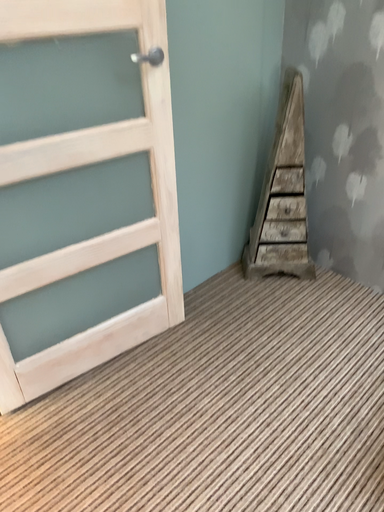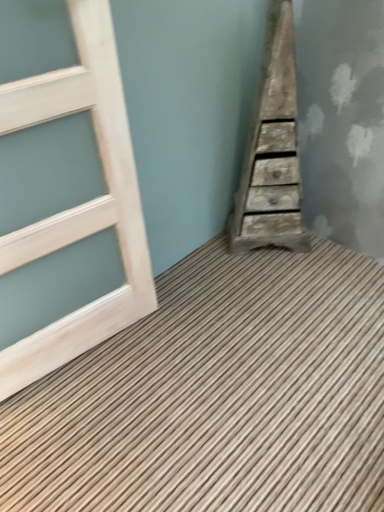
Question: Which way did the camera rotate in the video?

Choices:
 (A) rotated downward
 (B) rotated upward

Answer: (A)